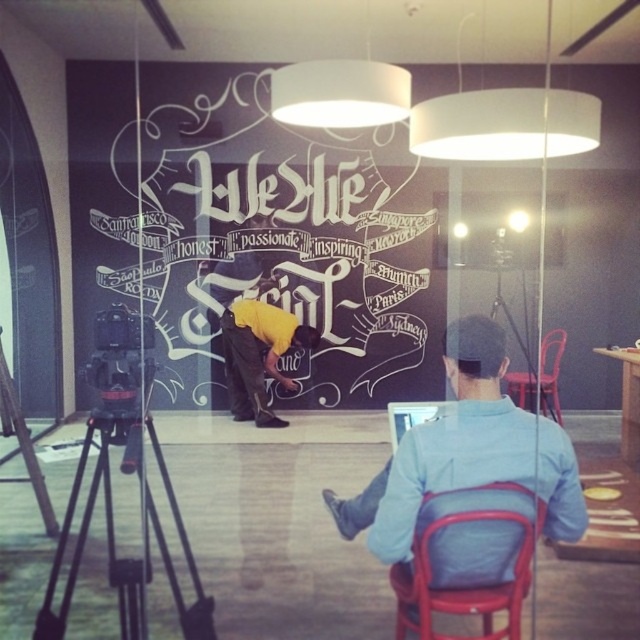
Question: Which point is closer to the camera taking this photo?

Choices:
 (A) (499, 337)
 (B) (232, 403)
 (C) (408, 586)

Answer: (C)

Question: Is black metal tripod at lower left to the left of light blue shirt at center from the viewer's perspective?

Choices:
 (A) no
 (B) yes

Answer: (B)

Question: Can you confirm if light blue shirt at center is bigger than red plastic chair at center?

Choices:
 (A) yes
 (B) no

Answer: (A)

Question: Is metallic red chair at lower right positioned before black metal tripod at lower left?

Choices:
 (A) yes
 (B) no

Answer: (A)

Question: Which point is closer to the camera taking this photo?

Choices:
 (A) (492, 396)
 (B) (209, 636)
 (C) (268, 417)

Answer: (A)

Question: Which point is farther to the camera?

Choices:
 (A) metallic red chair at lower right
 (B) light blue shirt at center

Answer: (B)